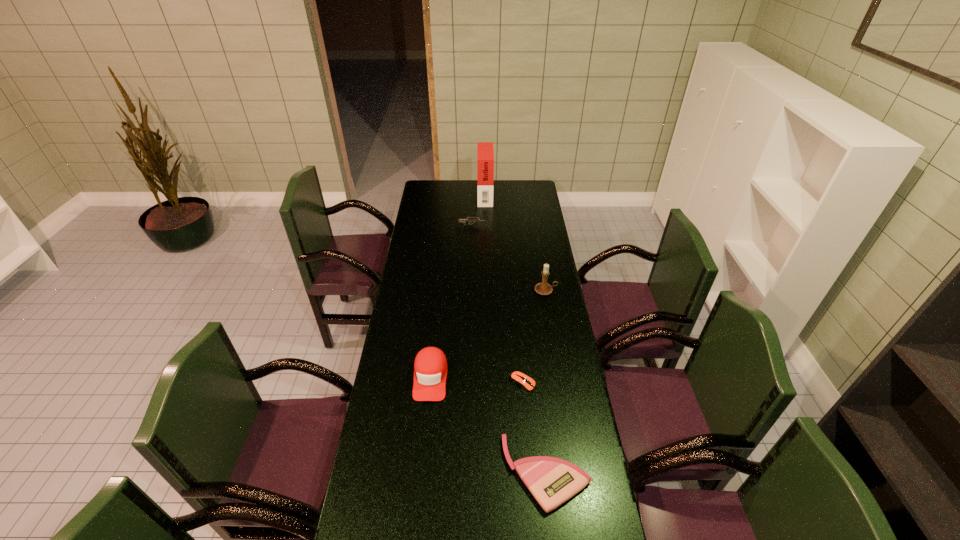
The width and height of the screenshot is (960, 540). Find the location of `wristlet located in the right edge section of the desktop`. wristlet located in the right edge section of the desktop is located at coordinates (552, 481).

At what (x,y) coordinates should I click in order to perform the action: click on computer mouse positioned at the right edge. Please return your answer as a coordinate pair (x, y). The image size is (960, 540). Looking at the image, I should click on (518, 378).

Locate an element on the screen. This screenshot has width=960, height=540. free region at the far edge of the desktop is located at coordinates (461, 196).

The image size is (960, 540). In order to click on vacant space at the left edge in this screenshot , I will do `click(439, 250)`.

You are a GUI agent. You are given a task and a screenshot of the screen. Output one action in this format:
    pyautogui.click(x=<x>, y=<y>)
    Task: Click on the vacant space at the right edge of the desktop
    Image resolution: width=960 pixels, height=540 pixels.
    Given the screenshot: What is the action you would take?
    pyautogui.click(x=545, y=244)

Locate an element on the screen. This screenshot has height=540, width=960. vacant space at the far right corner of the desktop is located at coordinates (519, 188).

The image size is (960, 540). What are the coordinates of `vacant space that is in between the baseball cap and the computer mouse` in the screenshot? It's located at (476, 380).

The height and width of the screenshot is (540, 960). What are the coordinates of `free space between the fourth tallest object and the second shortest object` in the screenshot? It's located at (509, 349).

Where is `vacant area between the computer mouse and the baseball cap`? The height and width of the screenshot is (540, 960). vacant area between the computer mouse and the baseball cap is located at coordinates (x=476, y=380).

Where is `vacant area that lies between the second shortest object and the shortest object`? This screenshot has width=960, height=540. vacant area that lies between the second shortest object and the shortest object is located at coordinates (535, 428).